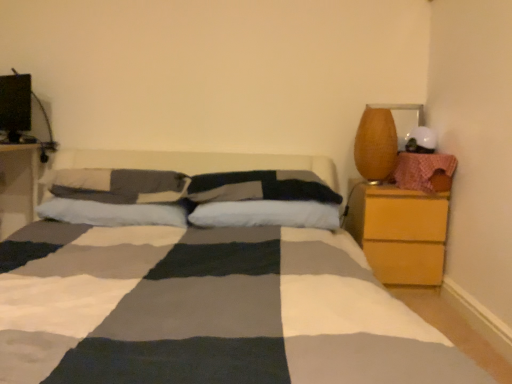
Question: From the image's perspective, would you say matte brown vase at right is positioned over white cotton pillow at center, the 1th pillow when ordered from left to right?

Choices:
 (A) no
 (B) yes

Answer: (B)

Question: Considering the relative sizes of matte brown vase at right and white cotton pillow at center, the 1th pillow when ordered from left to right, in the image provided, is matte brown vase at right thinner than white cotton pillow at center, the 1th pillow when ordered from left to right,?

Choices:
 (A) yes
 (B) no

Answer: (A)

Question: Is white cotton pillow at center, positioned as the fourth pillow in right-to-left order, located within matte brown vase at right?

Choices:
 (A) no
 (B) yes

Answer: (A)

Question: Does matte brown vase at right turn towards white cotton pillow at center, the 1th pillow when ordered from left to right?

Choices:
 (A) no
 (B) yes

Answer: (A)

Question: Is matte brown vase at right positioned with its back to white cotton pillow at center, positioned as the fourth pillow in right-to-left order?

Choices:
 (A) no
 (B) yes

Answer: (A)

Question: From their relative heights in the image, would you say wooden nightstand at left, which is the 2th nightstand in right-to-left order, is taller or shorter than white cotton pillow at center, the 1th pillow when ordered from left to right?

Choices:
 (A) short
 (B) tall

Answer: (B)

Question: Is wooden nightstand at left, which is the 2th nightstand in right-to-left order, in front of or behind white cotton pillow at center, positioned as the fourth pillow in right-to-left order, in the image?

Choices:
 (A) front
 (B) behind

Answer: (B)

Question: Which is correct: wooden nightstand at left, the 1th nightstand from the left, is inside white cotton pillow at center, the 1th pillow when ordered from left to right, or outside of it?

Choices:
 (A) outside
 (B) inside

Answer: (A)

Question: Looking at their shapes, would you say wooden nightstand at left, which is the 2th nightstand in right-to-left order, is wider or thinner than white cotton pillow at center, positioned as the fourth pillow in right-to-left order?

Choices:
 (A) thin
 (B) wide

Answer: (B)

Question: Is wooden nightstand at right, the 2th nightstand positioned from the left, taller or shorter than white soft pillow at center, placed as the fourth pillow when sorted from left to right?

Choices:
 (A) tall
 (B) short

Answer: (A)

Question: From the image's perspective, is wooden nightstand at right, the 1th nightstand positioned from the right, above or below white soft pillow at center, which is the 1th pillow in right-to-left order?

Choices:
 (A) below
 (B) above

Answer: (A)

Question: Is wooden nightstand at right, the 2th nightstand positioned from the left, in front of or behind white soft pillow at center, which is the 1th pillow in right-to-left order, in the image?

Choices:
 (A) behind
 (B) front

Answer: (A)

Question: Based on their positions, is wooden nightstand at right, the 1th nightstand positioned from the right, located to the left or right of white soft pillow at center, placed as the fourth pillow when sorted from left to right?

Choices:
 (A) right
 (B) left

Answer: (A)

Question: In terms of width, does white soft pillow at center, which is the 1th pillow in right-to-left order, look wider or thinner when compared to white cotton pillow at center, the 1th pillow when ordered from left to right?

Choices:
 (A) wide
 (B) thin

Answer: (B)

Question: Is point 292,223 closer or farther from the camera than point 160,178?

Choices:
 (A) closer
 (B) farther

Answer: (A)